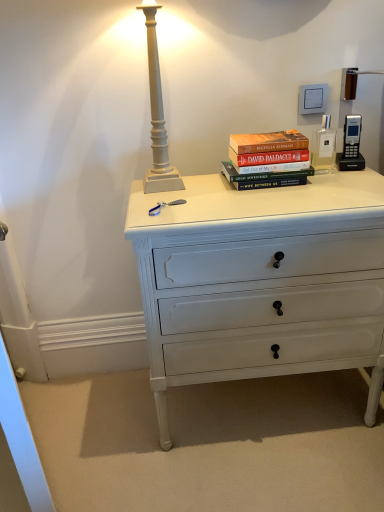
Where is `white painted wood chest of drawers at center`? white painted wood chest of drawers at center is located at coordinates (261, 281).

The width and height of the screenshot is (384, 512). What do you see at coordinates (261, 281) in the screenshot?
I see `white painted wood chest of drawers at center` at bounding box center [261, 281].

Measure the distance between white painted wood chest of drawers at center and camera.

white painted wood chest of drawers at center and camera are 1.00 meters apart from each other.

Where is `hardcover books at center`? hardcover books at center is located at coordinates (268, 160).

What is the approximate width of hardcover books at center?

hardcover books at center is 8.45 inches wide.

Measure the distance between point (283, 168) and camera.

A distance of 3.89 feet exists between point (283, 168) and camera.

Describe the element at coordinates (268, 160) in the screenshot. I see `hardcover books at center` at that location.

At what (x,y) coordinates should I click in order to perform the action: click on white painted wood chest of drawers at center. Please return your answer as a coordinate pair (x, y). This screenshot has height=512, width=384. Looking at the image, I should click on (261, 281).

Which is more to the left, white painted wood chest of drawers at center or hardcover books at center?

hardcover books at center.

In the image, is white painted wood chest of drawers at center positioned in front of or behind hardcover books at center?

Visually, white painted wood chest of drawers at center is located in front of hardcover books at center.

Which point is more forward, (216, 263) or (232, 152)?

Positioned in front is point (216, 263).

From the image's perspective, which is below, white painted wood chest of drawers at center or hardcover books at center?

white painted wood chest of drawers at center, from the image's perspective.

From a real-world perspective, is white painted wood chest of drawers at center physically located above or below hardcover books at center?

white painted wood chest of drawers at center is situated lower than hardcover books at center in the real world.

Which object is thinner, white painted wood chest of drawers at center or hardcover books at center?

hardcover books at center is thinner.

Can you confirm if white painted wood chest of drawers at center is taller than hardcover books at center?

Yes, white painted wood chest of drawers at center is taller than hardcover books at center.

Does white painted wood chest of drawers at center have a smaller size compared to hardcover books at center?

No.

Is white painted wood chest of drawers at center not inside hardcover books at center?

Yes, white painted wood chest of drawers at center is not within hardcover books at center.

Is white painted wood chest of drawers at center beside hardcover books at center?

No, white painted wood chest of drawers at center is not next to hardcover books at center.

Is white painted wood chest of drawers at center facing towards hardcover books at center?

No, white painted wood chest of drawers at center is not aimed at hardcover books at center.

At what (x,y) coordinates should I click in order to perform the action: click on chest of drawers that appears on the right of hardcover books at center. Please return your answer as a coordinate pair (x, y). Looking at the image, I should click on (261, 281).

Can you confirm if hardcover books at center is positioned to the left of white painted wood chest of drawers at center?

Yes.

Which is behind, hardcover books at center or white painted wood chest of drawers at center?

hardcover books at center is further away from the camera.

Does point (266, 173) come in front of point (300, 317)?

Yes.

From the image's perspective, does hardcover books at center appear higher than white painted wood chest of drawers at center?

Yes, from the image's perspective, hardcover books at center is above white painted wood chest of drawers at center.

From a real-world perspective, who is located lower, hardcover books at center or white painted wood chest of drawers at center?

white painted wood chest of drawers at center, from a real-world perspective.

In terms of width, does hardcover books at center look wider or thinner when compared to white painted wood chest of drawers at center?

Considering their sizes, hardcover books at center looks slimmer than white painted wood chest of drawers at center.

In terms of height, does hardcover books at center look taller or shorter compared to white painted wood chest of drawers at center?

Considering their sizes, hardcover books at center has less height than white painted wood chest of drawers at center.

Considering the sizes of objects hardcover books at center and white painted wood chest of drawers at center in the image provided, who is smaller, hardcover books at center or white painted wood chest of drawers at center?

With smaller size is hardcover books at center.

Is hardcover books at center located outside white painted wood chest of drawers at center?

Yes, hardcover books at center is not within white painted wood chest of drawers at center.

Is hardcover books at center in contact with white painted wood chest of drawers at center?

They are not placed beside each other.

Is hardcover books at center aimed at white painted wood chest of drawers at center?

No, hardcover books at center is not turned towards white painted wood chest of drawers at center.

Measure the distance between hardcover books at center and white painted wood chest of drawers at center.

hardcover books at center and white painted wood chest of drawers at center are 28.69 centimeters apart.

The width and height of the screenshot is (384, 512). What are the coordinates of `chest of drawers that is on the right side of hardcover books at center` in the screenshot? It's located at (261, 281).

What are the coordinates of `book above the white painted wood chest of drawers at center (from a real-world perspective)` in the screenshot? It's located at (268, 160).

You are a GUI agent. You are given a task and a screenshot of the screen. Output one action in this format:
    pyautogui.click(x=<x>, y=<y>)
    Task: Click on the book that is behind the white painted wood chest of drawers at center
    The height and width of the screenshot is (512, 384).
    Given the screenshot: What is the action you would take?
    pyautogui.click(x=268, y=160)